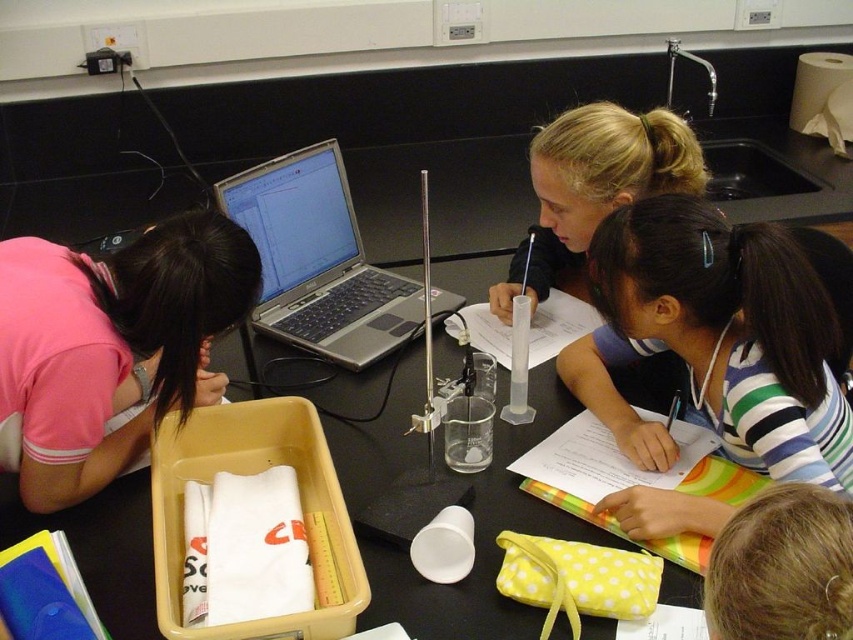
Is pink fabric at left shorter than silver metallic laptop at center?

Indeed, pink fabric at left has a lesser height compared to silver metallic laptop at center.

Can you confirm if pink fabric at left is bigger than silver metallic laptop at center?

No.

Is point (51, 262) closer to viewer compared to point (354, 212)?

Yes, it is in front of point (354, 212).

Find the location of a particular element. The image size is (853, 640). pink fabric at left is located at coordinates (112, 344).

Between point (120, 276) and point (817, 550), which one is positioned in front?

Point (817, 550) is more forward.

Does pink fabric at left have a lesser width compared to blonde hair at upper center?

No.

This screenshot has height=640, width=853. Identify the location of pink fabric at left. (112, 344).

Does striped fabric shirt at center have a greater height compared to blonde hair at upper center?

Yes.

Between point (827, 408) and point (773, 602), which one is positioned behind?

Point (827, 408)

You are a GUI agent. You are given a task and a screenshot of the screen. Output one action in this format:
    pyautogui.click(x=<x>, y=<y>)
    Task: Click on the striped fabric shirt at center
    The width and height of the screenshot is (853, 640).
    Given the screenshot: What is the action you would take?
    pyautogui.click(x=717, y=339)